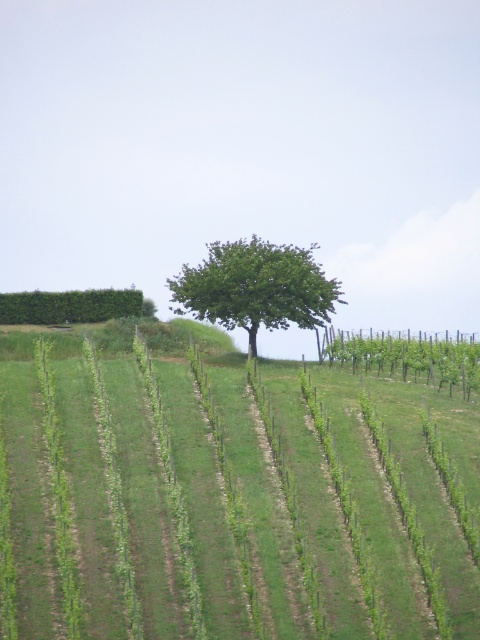
Question: Which object appears closest to the camera in this image?

Choices:
 (A) green grassy field at center
 (B) green leafy tree at center

Answer: (A)

Question: Which object appears farthest from the camera in this image?

Choices:
 (A) green leafy tree at center
 (B) green grassy field at center

Answer: (A)

Question: Which point is farther to the camera?

Choices:
 (A) green grassy field at center
 (B) green leafy tree at center

Answer: (B)

Question: Does green grassy field at center appear under green leafy tree at center?

Choices:
 (A) yes
 (B) no

Answer: (A)

Question: Does green grassy field at center come in front of green leafy tree at center?

Choices:
 (A) yes
 (B) no

Answer: (A)

Question: Where is green grassy field at center located in relation to green leafy tree at center in the image?

Choices:
 (A) left
 (B) right

Answer: (B)